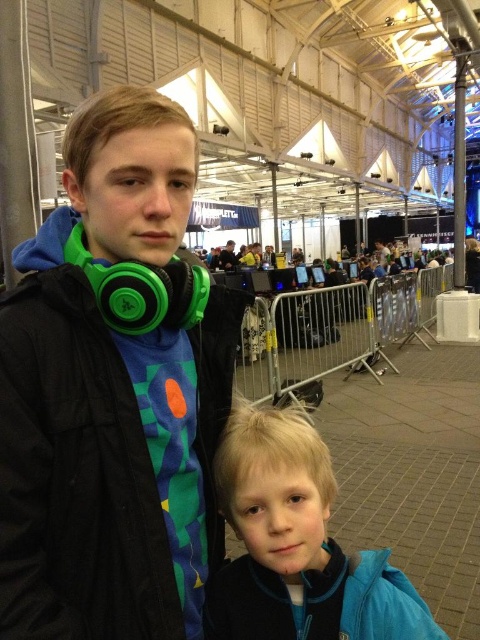
Between point (187, 184) and point (228, 248), which one is positioned in front?

Positioned in front is point (187, 184).

How distant is green matte headphones at upper left from matte black headphones at upper left?

green matte headphones at upper left and matte black headphones at upper left are 19.16 meters apart from each other.

Between point (111, 634) and point (238, 260), which one is positioned behind?

Point (238, 260)

Locate an element on the screen. The height and width of the screenshot is (640, 480). green matte headphones at upper left is located at coordinates (110, 400).

Can you confirm if green matte headphones at upper left is taller than blue fleece jacket at lower right?

Yes.

What do you see at coordinates (110, 400) in the screenshot? I see `green matte headphones at upper left` at bounding box center [110, 400].

This screenshot has width=480, height=640. I want to click on green matte headphones at upper left, so click(110, 400).

Who is positioned more to the left, blue fleece jacket at lower right or matte black headphones at upper left?

matte black headphones at upper left

Does point (242, 524) come closer to viewer compared to point (225, 259)?

Yes, point (242, 524) is in front of point (225, 259).

Image resolution: width=480 pixels, height=640 pixels. Describe the element at coordinates (298, 545) in the screenshot. I see `blue fleece jacket at lower right` at that location.

Find the location of `blue fleece jacket at lower right`. blue fleece jacket at lower right is located at coordinates (298, 545).